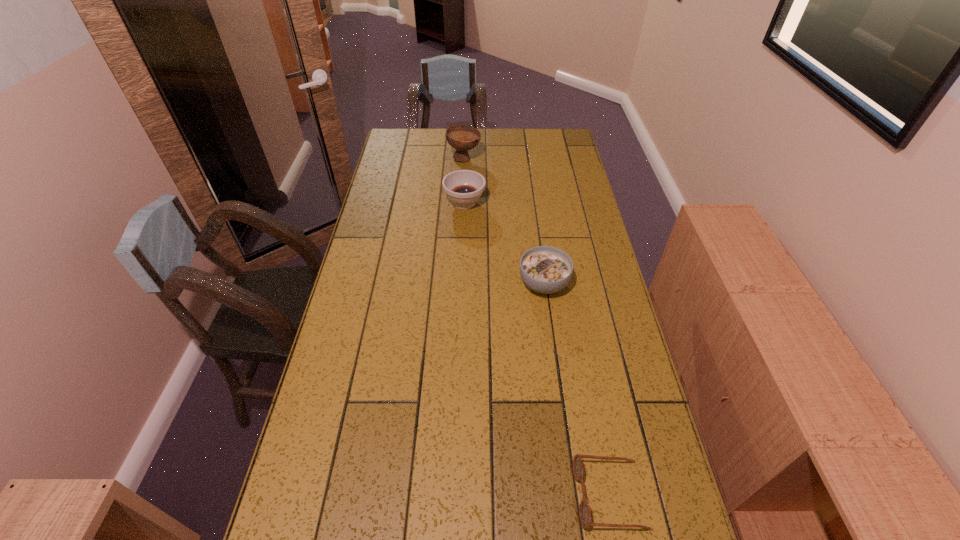
Image resolution: width=960 pixels, height=540 pixels. Identify the location of free space between the spectacles and the second farthest object. (537, 348).

At what (x,y) coordinates should I click in order to perform the action: click on free point between the tallest object and the nearest object. Please return your answer as a coordinate pair (x, y). Looking at the image, I should click on (537, 326).

The width and height of the screenshot is (960, 540). Identify the location of free space between the nearest object and the nearest soup bowl. (576, 389).

At what (x,y) coordinates should I click in order to perform the action: click on unoccupied position between the second farthest soup bowl and the nearest object. Please return your answer as a coordinate pair (x, y). Looking at the image, I should click on (537, 348).

You are a GUI agent. You are given a task and a screenshot of the screen. Output one action in this format:
    pyautogui.click(x=<x>, y=<y>)
    Task: Click on the blank region between the nearest object and the farthest soup bowl
    The width and height of the screenshot is (960, 540).
    Given the screenshot: What is the action you would take?
    coord(537,326)

The width and height of the screenshot is (960, 540). Identify the location of free space between the third nearest object and the nearest soup bowl. (504, 243).

Where is `free space between the rightmost soup bowl and the farthest soup bowl`? free space between the rightmost soup bowl and the farthest soup bowl is located at coordinates (504, 221).

Locate an element on the screen. This screenshot has width=960, height=540. free space between the spectacles and the nearest soup bowl is located at coordinates (576, 389).

The height and width of the screenshot is (540, 960). I want to click on vacant area that lies between the third farthest object and the shortest object, so click(x=576, y=389).

Select which object is the third closest to the second farthest soup bowl. Please provide its 2D coordinates. Your answer should be formatted as a tuple, i.e. [(x, y)], where the tuple contains the x and y coordinates of a point satisfying the conditions above.

[(584, 508)]